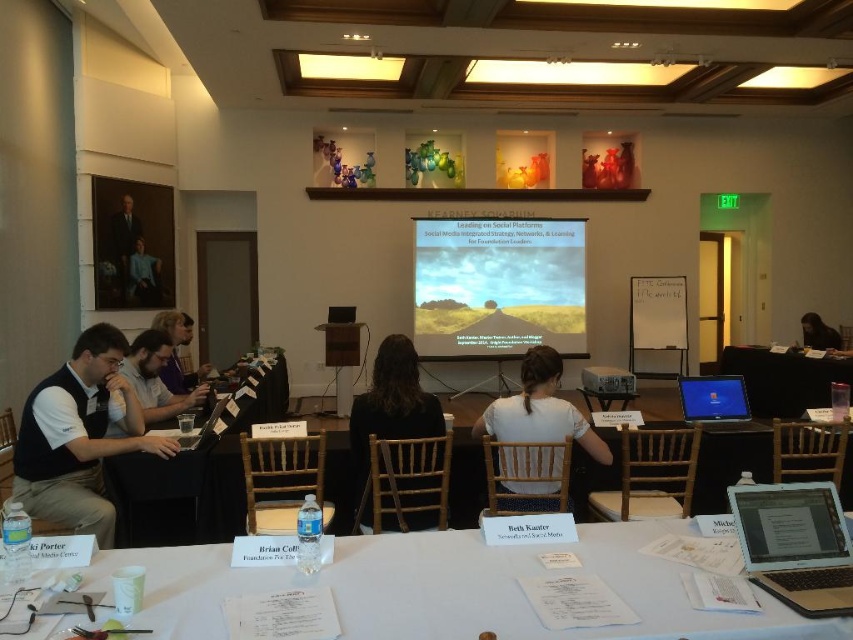
Does matte black shirt at upper left have a lesser height compared to black fabric chair at upper right?

No, matte black shirt at upper left is not shorter than black fabric chair at upper right.

Locate an element on the screen. This screenshot has width=853, height=640. matte black shirt at upper left is located at coordinates (143, 275).

The width and height of the screenshot is (853, 640). I want to click on matte black shirt at upper left, so click(x=143, y=275).

Between black fabric jacket at center and matte black shirt at upper left, which one appears on the left side from the viewer's perspective?

matte black shirt at upper left is more to the left.

Who is lower down, black fabric jacket at center or matte black shirt at upper left?

black fabric jacket at center

Image resolution: width=853 pixels, height=640 pixels. Identify the location of black fabric jacket at center. (392, 404).

Can you confirm if black plastic table at center is positioned to the right of white plastic projector at center?

Indeed, black plastic table at center is positioned on the right side of white plastic projector at center.

Does black plastic table at center have a larger size compared to white plastic projector at center?

Correct, black plastic table at center is larger in size than white plastic projector at center.

Is point (786, 376) closer to viewer compared to point (605, 384)?

That is False.

I want to click on black plastic table at center, so click(782, 380).